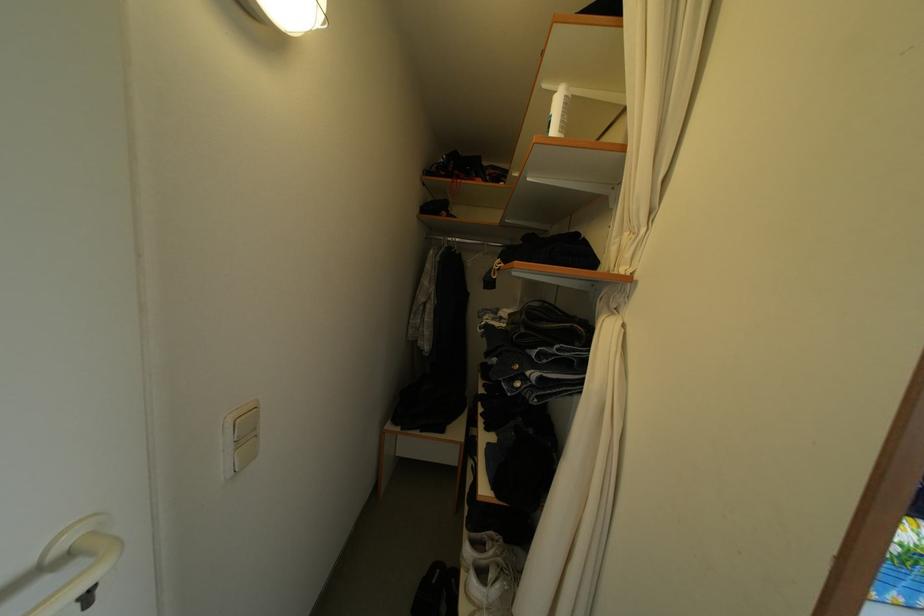
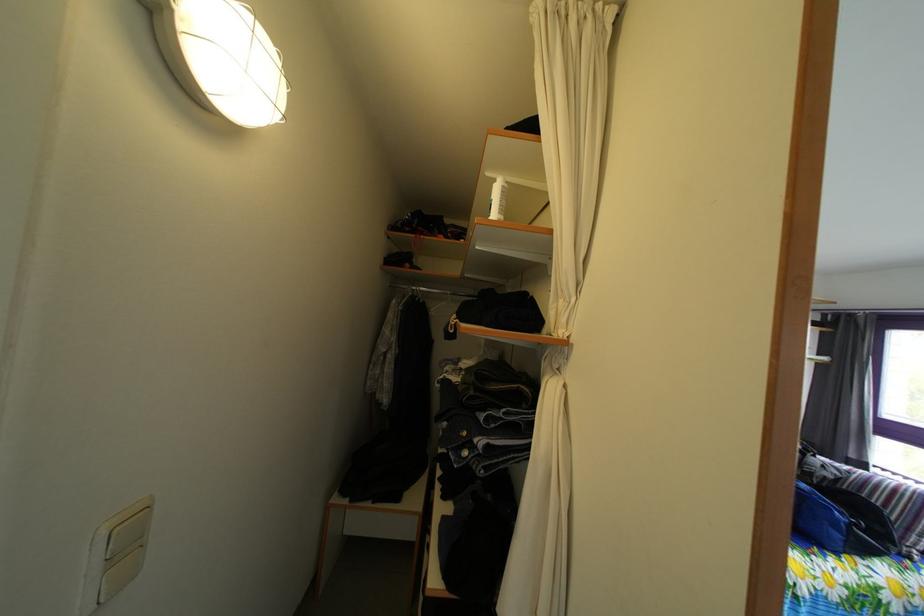
Question: The first image is from the beginning of the video and the second image is from the end. How did the camera likely rotate when shooting the video?

Choices:
 (A) Left
 (B) Right
 (C) Up
 (D) Down

Answer: (C)